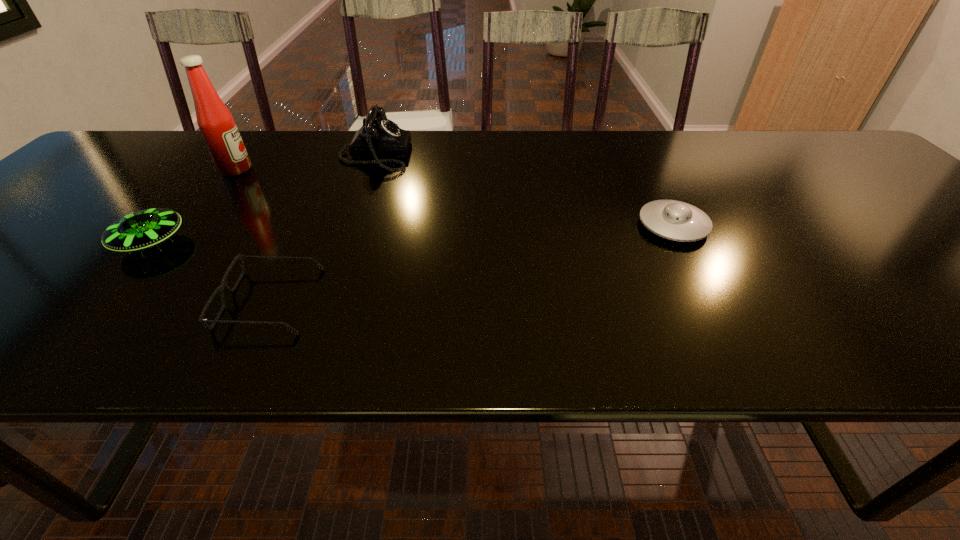
Locate an element on the screen. This screenshot has width=960, height=540. condiment is located at coordinates (216, 123).

Identify the location of telephone. 379,136.

Image resolution: width=960 pixels, height=540 pixels. Identify the location of the third shortest object. (142, 229).

Where is `the taller saucer`? The height and width of the screenshot is (540, 960). the taller saucer is located at coordinates (142, 229).

Image resolution: width=960 pixels, height=540 pixels. What are the coordinates of `the right saucer` in the screenshot? It's located at (674, 220).

The width and height of the screenshot is (960, 540). Identify the location of the shorter saucer. (674, 220).

Locate an element on the screen. The width and height of the screenshot is (960, 540). the nearest object is located at coordinates 202,321.

Locate an element on the screen. This screenshot has height=540, width=960. vacant space located 0.260m on the front-facing side of the tallest object is located at coordinates click(x=351, y=170).

Where is `free space located on the dial of the telephone`? free space located on the dial of the telephone is located at coordinates (449, 154).

You are a GUI agent. You are given a task and a screenshot of the screen. Output one action in this format:
    pyautogui.click(x=<x>, y=<y>)
    Task: Click on the blank space located on the right of the taller saucer
    The image size is (960, 540).
    Given the screenshot: What is the action you would take?
    pyautogui.click(x=296, y=243)